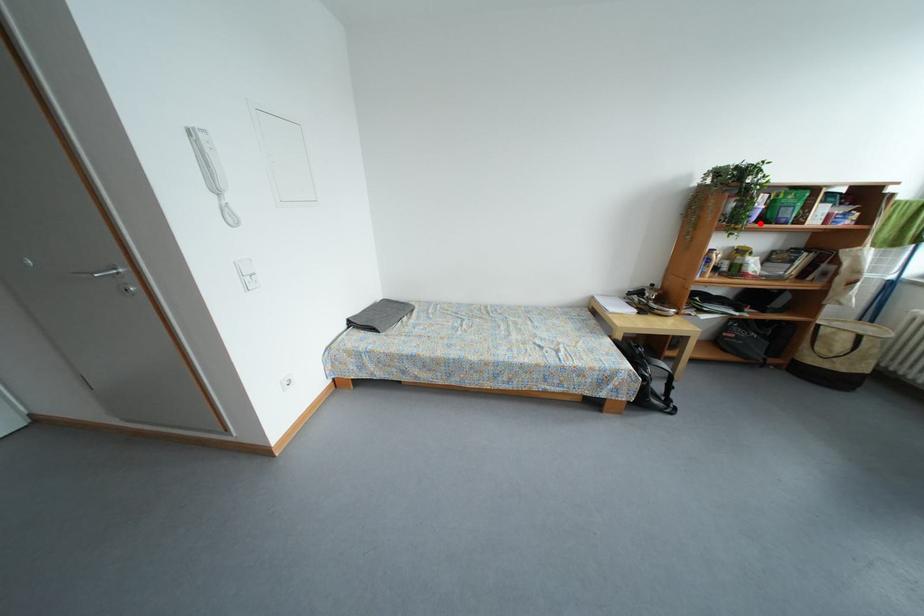
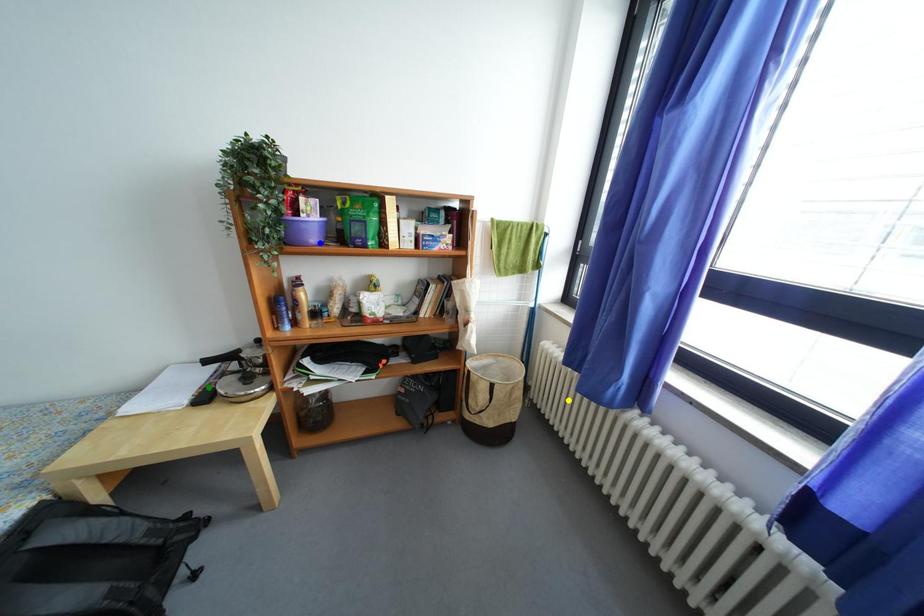
Question: I am providing you with two images of the same scene from different viewpoints. A red point is marked on the first image. You are given multiple points on the second image. Which spot in image 2 lines up with the point in image 1?

Choices:
 (A) green point
 (B) yellow point
 (C) blue point

Answer: (C)